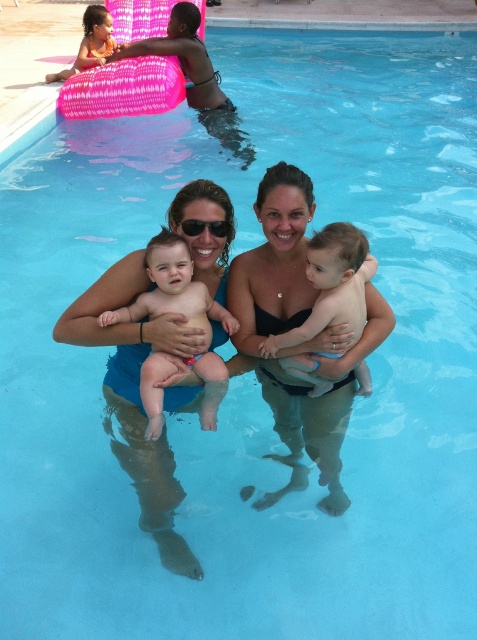
Is nude skin baby at center taller than smooth skin baby at center?

Correct, nude skin baby at center is much taller as smooth skin baby at center.

Describe the element at coordinates (186, 324) in the screenshot. I see `nude skin baby at center` at that location.

The height and width of the screenshot is (640, 477). In order to click on nude skin baby at center in this screenshot , I will do `click(186, 324)`.

Is blue fabric at center smaller than nude skin baby at center?

No.

Is point (105, 432) positioned after point (179, 296)?

Yes, point (105, 432) is farther from viewer.

Identify the location of blue fabric at center. The width and height of the screenshot is (477, 640). (135, 397).

Is nude skin baby at center thinner than black plastic goggles at center?

No, nude skin baby at center is not thinner than black plastic goggles at center.

How distant is nude skin baby at center from black plastic goggles at center?

nude skin baby at center and black plastic goggles at center are 16.29 inches apart.

Between point (148, 404) and point (219, 236), which one is positioned behind?

Point (219, 236)

Image resolution: width=477 pixels, height=640 pixels. In order to click on nude skin baby at center in this screenshot , I will do `click(186, 324)`.